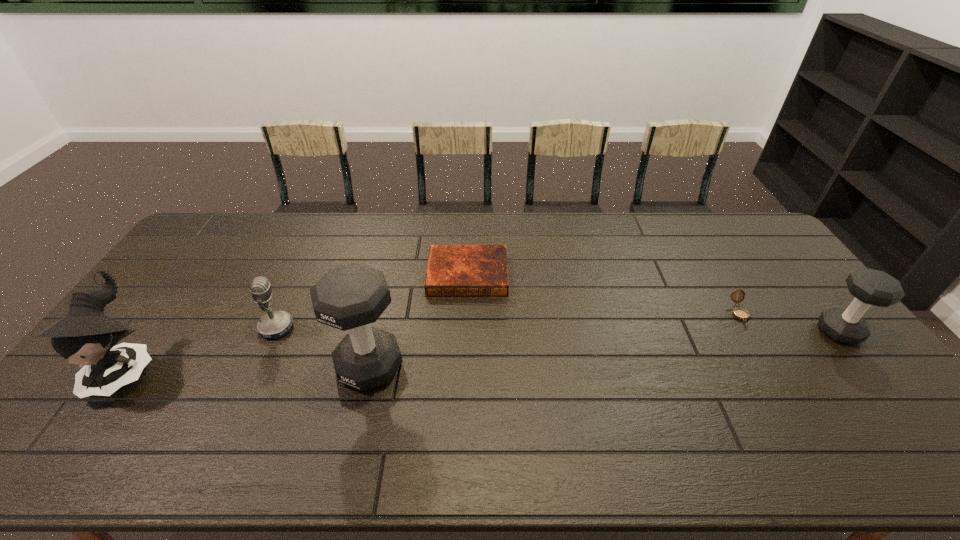
At what (x,y) coordinates should I click in order to perform the action: click on the taller dumbbell. Please return your answer as a coordinate pair (x, y). This screenshot has height=540, width=960. Looking at the image, I should click on (350, 297).

Locate an element on the screen. the left dumbbell is located at coordinates (350, 297).

At what (x,y) coordinates should I click in order to perform the action: click on the shorter dumbbell. Please return your answer as a coordinate pair (x, y). Image resolution: width=960 pixels, height=540 pixels. Looking at the image, I should click on (869, 287).

This screenshot has height=540, width=960. Identify the location of the right dumbbell. (869, 287).

The width and height of the screenshot is (960, 540). Identify the location of compass. (739, 313).

Locate an element on the screen. This screenshot has height=540, width=960. the fifth tallest object is located at coordinates (739, 313).

Locate an element on the screen. This screenshot has width=960, height=540. the fifth object from right to left is located at coordinates (276, 324).

Where is `the leftmost object`? The height and width of the screenshot is (540, 960). the leftmost object is located at coordinates (86, 336).

Locate an element on the screen. The image size is (960, 540). the fifth shortest object is located at coordinates (86, 336).

In order to click on the shortest object in this screenshot , I will do `click(452, 270)`.